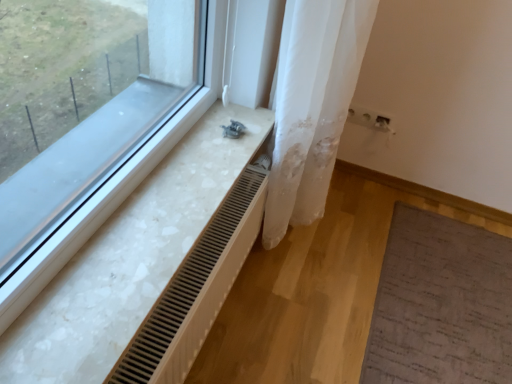
The width and height of the screenshot is (512, 384). I want to click on vacant area that is situated to the right of white sheer fabric at center, so click(352, 240).